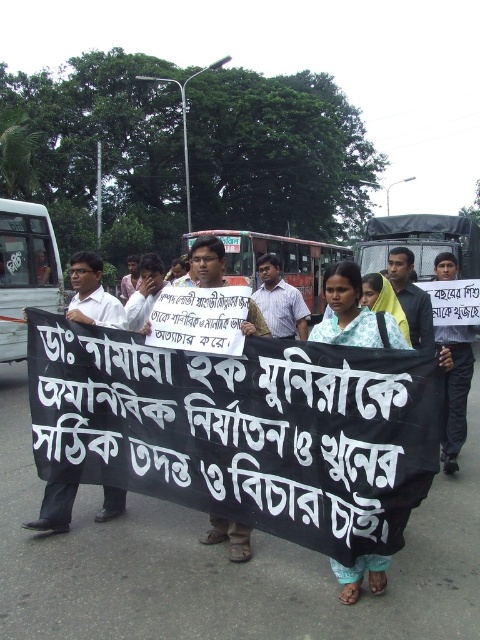
Question: Which point appears farthest from the camera in this image?

Choices:
 (A) (274, 336)
 (B) (248, 408)

Answer: (A)

Question: Which object is closer to the camera taking this photo?

Choices:
 (A) metallic silver bus at center
 (B) white shirt at left
 (C) light brown shirt at center

Answer: (B)

Question: Estimate the real-world distances between objects in this image. Which object is farther from the light brown shirt at center?

Choices:
 (A) white cloth banner at center
 (B) red painted metal bus at center
 (C) white plastic bus at left

Answer: (B)

Question: Does white cloth banner at center have a larger size compared to white paper sign at center?

Choices:
 (A) yes
 (B) no

Answer: (A)

Question: Can you confirm if red painted metal bus at center is smaller than white paper sign at center?

Choices:
 (A) no
 (B) yes

Answer: (A)

Question: Can you confirm if white plastic bus at left is positioned below red painted metal bus at center?

Choices:
 (A) yes
 (B) no

Answer: (A)